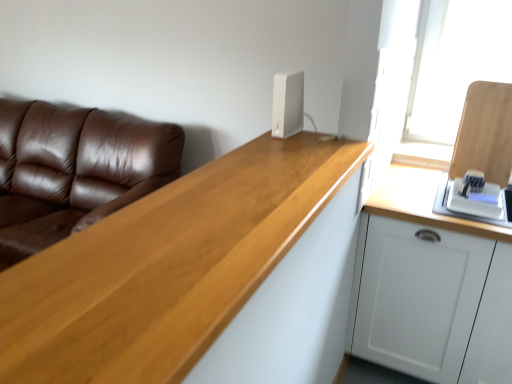
Question: Would you say light wood countertop at center contains white plastic router at upper center?

Choices:
 (A) no
 (B) yes

Answer: (A)

Question: Is light wood countertop at center next to white plastic router at upper center?

Choices:
 (A) no
 (B) yes

Answer: (A)

Question: Does light wood countertop at center come in front of white plastic router at upper center?

Choices:
 (A) no
 (B) yes

Answer: (B)

Question: From a real-world perspective, is light wood countertop at center located higher than white plastic router at upper center?

Choices:
 (A) no
 (B) yes

Answer: (A)

Question: Does light wood countertop at center appear on the right side of white plastic router at upper center?

Choices:
 (A) no
 (B) yes

Answer: (A)

Question: From a real-world perspective, is brown leather couch at left above or below white matte cabinet at right?

Choices:
 (A) above
 (B) below

Answer: (A)

Question: Is brown leather couch at left to the left or to the right of white matte cabinet at right in the image?

Choices:
 (A) right
 (B) left

Answer: (B)

Question: Does point (157, 178) appear closer or farther from the camera than point (467, 344)?

Choices:
 (A) farther
 (B) closer

Answer: (A)

Question: From the image's perspective, relative to white matte cabinet at right, is brown leather couch at left above or below?

Choices:
 (A) below
 (B) above

Answer: (B)

Question: Is white plastic router at upper center to the left or to the right of brown leather couch at left in the image?

Choices:
 (A) right
 (B) left

Answer: (A)

Question: Is point (298, 72) positioned closer to the camera than point (115, 160)?

Choices:
 (A) closer
 (B) farther

Answer: (A)

Question: From the image's perspective, is white plastic router at upper center located above or below brown leather couch at left?

Choices:
 (A) below
 (B) above

Answer: (B)

Question: Is white plastic router at upper center taller or shorter than brown leather couch at left?

Choices:
 (A) short
 (B) tall

Answer: (A)

Question: From the image's perspective, relative to white plastic router at upper center, is white matte cabinet at right above or below?

Choices:
 (A) below
 (B) above

Answer: (A)

Question: In terms of height, does white matte cabinet at right look taller or shorter compared to white plastic router at upper center?

Choices:
 (A) tall
 (B) short

Answer: (A)